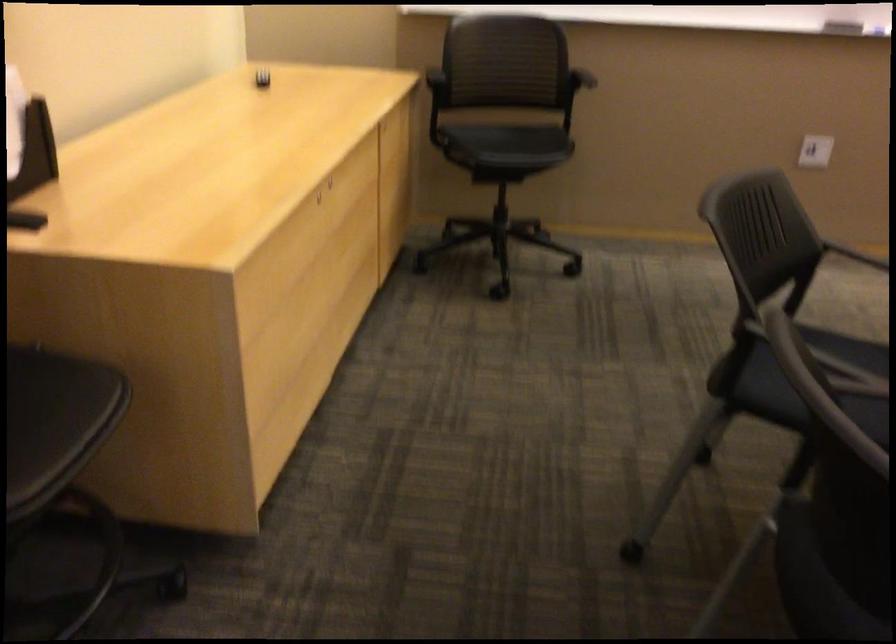
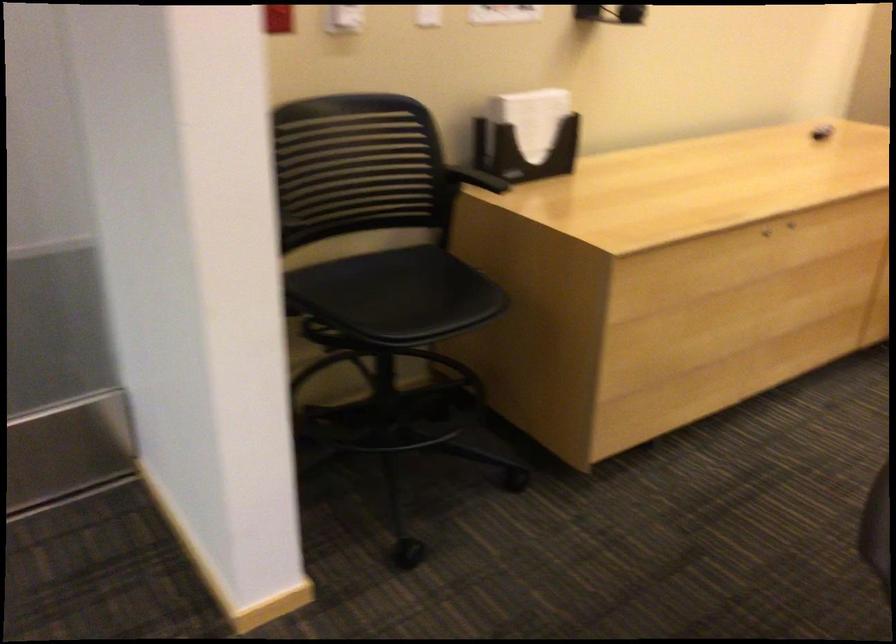
Where in the second image is the point corresponding to the point at 343,187 from the first image?

(790, 225)